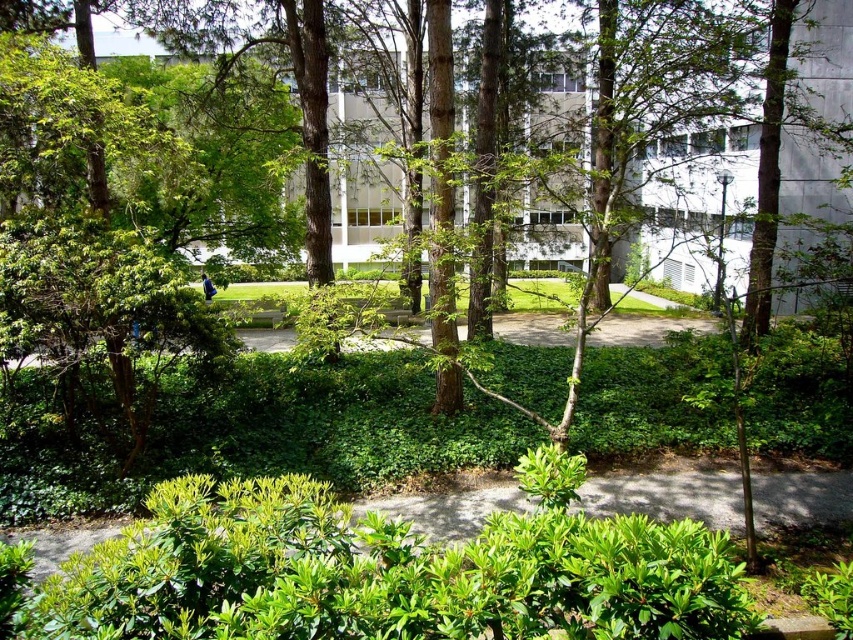
You are standing at the start of the pathway and want to walk to the large modern building in the background. There is a green leafy bush at center and a green leafy tree at center in your way. How far apart are these two obstacles from each other?

The green leafy bush at center is 17.23 feet away from the green leafy tree at center.

You are a gardener who wants to plant a new flower bed between the green leafy bush at center and the green leafy tree at center. Since the flower bed requires a minimum of 1 meter of space, can you determine if there is enough space between them based on their heights?

The green leafy bush at center is shorter than the green leafy tree at center, but their heights do not determine the distance between them. The question about space for the flower bed cannot be answered with the given information about their heights.